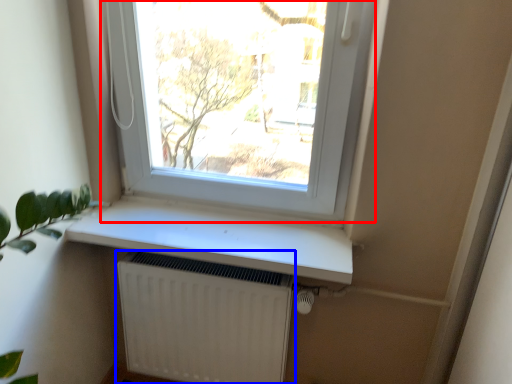
Question: Which object is further to the camera taking this photo, window (highlighted by a red box) or radiator (highlighted by a blue box)?

Choices:
 (A) window
 (B) radiator

Answer: (B)